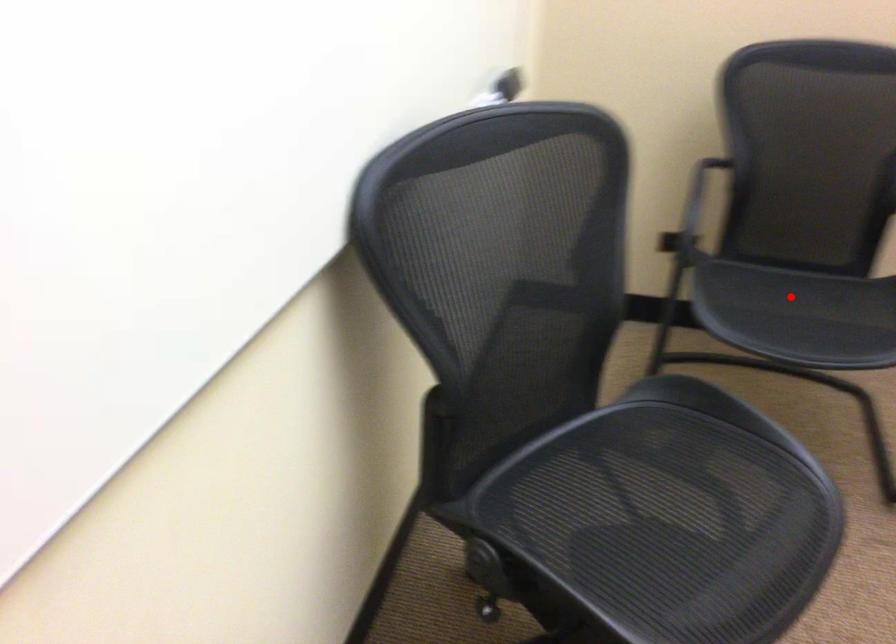
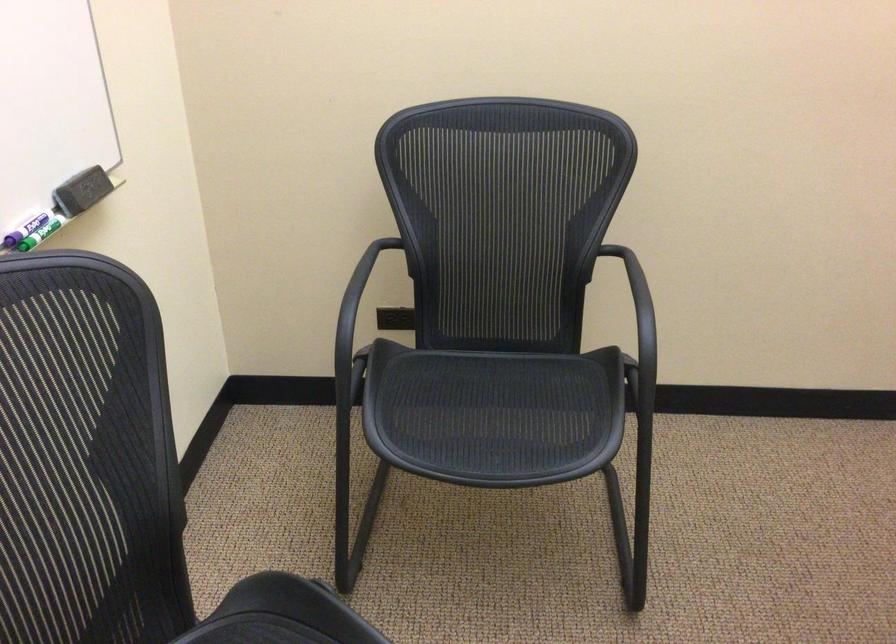
Question: I am providing you with two images of the same scene from different viewpoints. A red point is shown in image1. For the corresponding object point in image2, is it positioned nearer or farther from the camera?

Choices:
 (A) Nearer
 (B) Farther

Answer: (A)